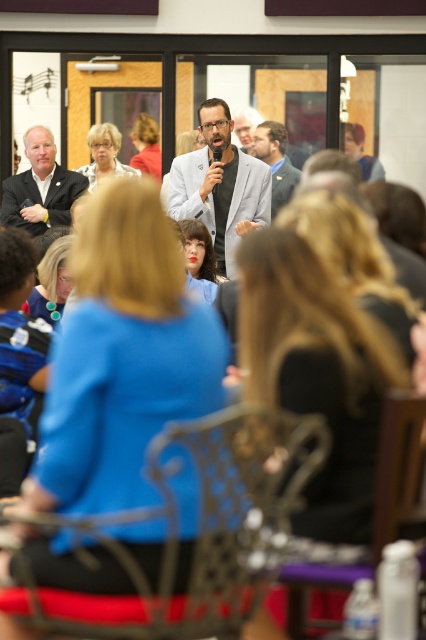
You are sitting in the audience and want to point out the matte black suit at left and the matte blue shirt at lower center to a friend. Which one is positioned higher in the image?

The matte black suit at left is located above the matte blue shirt at lower center, so it is positioned higher in the image.

You are organizing a small event and need to place a 7.5 feet long table between the blonde hair at upper left and the matte black jacket at upper right. Can the table fit in the space between them?

The distance between the blonde hair at upper left and the matte black jacket at upper right is 9.37 feet, so a 7.5 feet long table can fit in the space between them since it is shorter than the available distance.